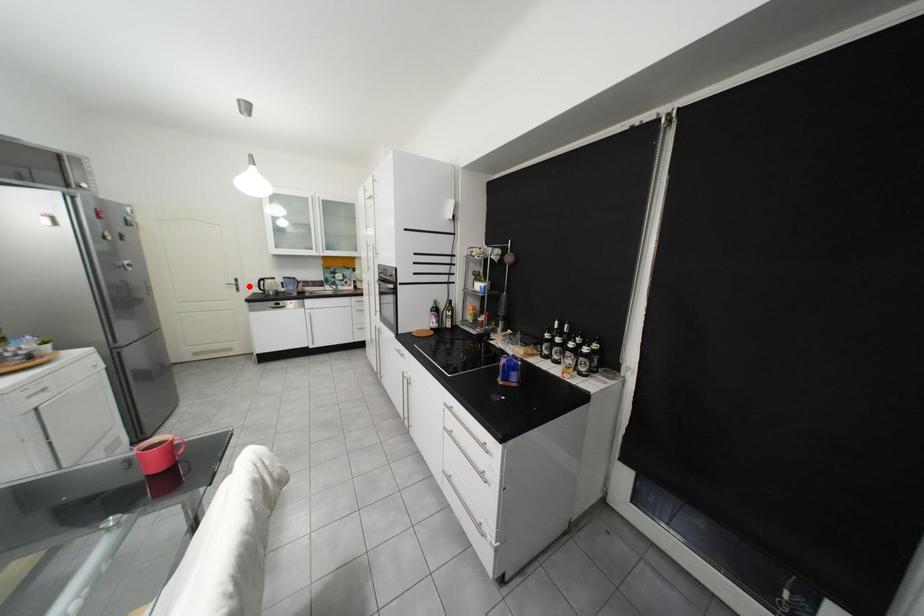
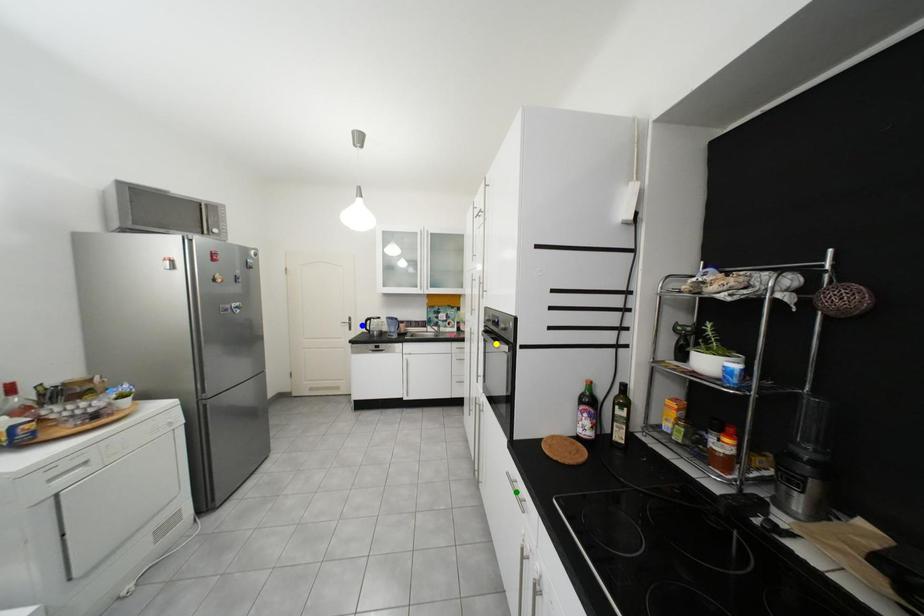
Question: I am providing you with two images of the same scene from different viewpoints. A red point is marked on the first image. You are given multiple points on the second image. In image 2, which mark is for the same physical point as the one in image 1?

Choices:
 (A) yellow point
 (B) green point
 (C) blue point

Answer: (C)